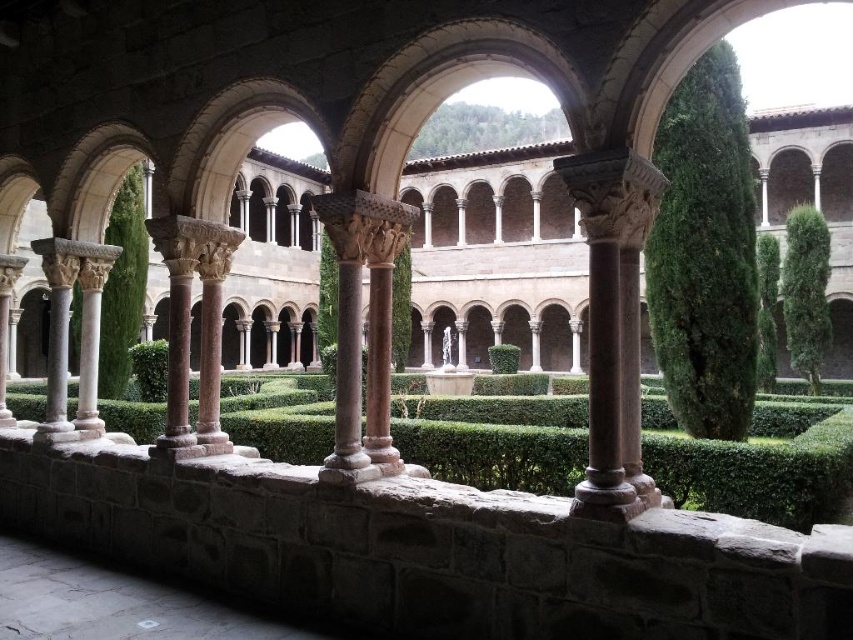
You are standing in the cloister and want to take a photo of the brown stone column at center and the green leafy hedge at left. Which object should you position closer to the left side of your camera frame to include both in the shot?

The green leafy hedge at left should be positioned closer to the left side of your camera frame since the brown stone column at center is on the right side of the green leafy hedge at left.

You are standing at the entrance of the cloister and want to locate the brown stone column at center. According to the coordinates provided, where exactly is it positioned?

The brown stone column at center is positioned at coordinates point (613, 324).